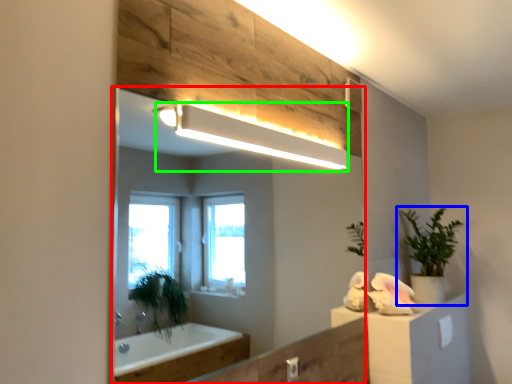
Question: Based on their relative distances, which object is nearer to mirror (highlighted by a red box)? Choose from houseplant (highlighted by a blue box) and light fixture (highlighted by a green box).

Choices:
 (A) houseplant
 (B) light fixture

Answer: (A)